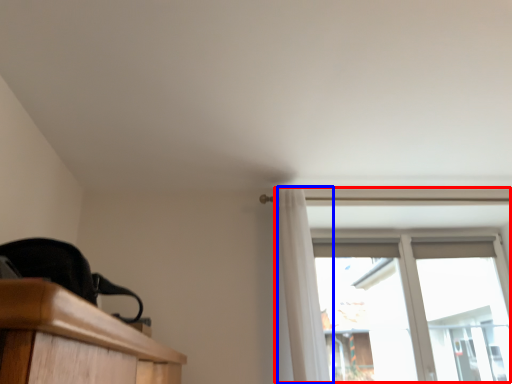
Question: Which object is further to the camera taking this photo, window (highlighted by a red box) or curtain (highlighted by a blue box)?

Choices:
 (A) window
 (B) curtain

Answer: (A)